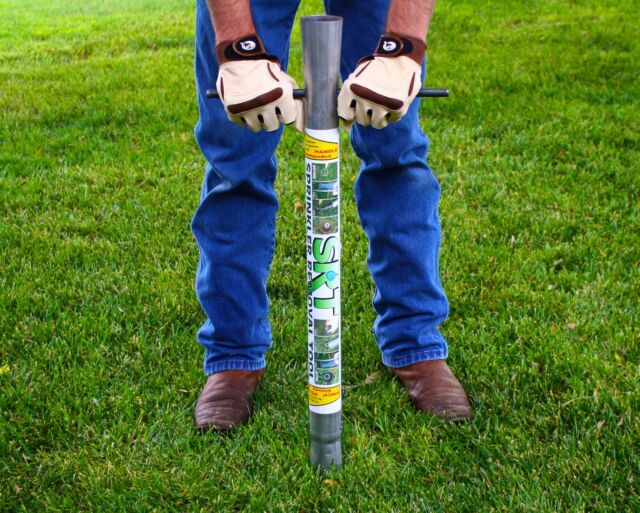
Find the location of `the left handle`. the left handle is located at coordinates (436, 93).